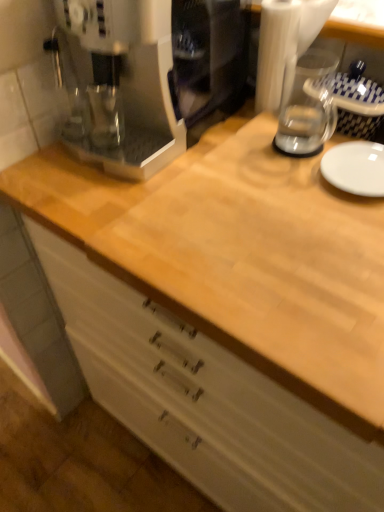
The width and height of the screenshot is (384, 512). I want to click on free space in front of transparent glass blender at upper right, so click(x=268, y=147).